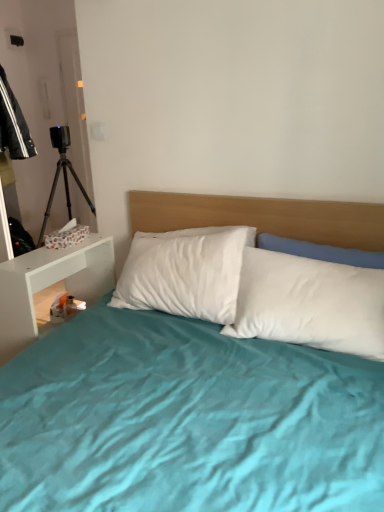
Where is `white plastic nightstand at left`? white plastic nightstand at left is located at coordinates (50, 285).

What is the approximate height of white plastic nightstand at left?

It is 31.94 inches.

Describe the element at coordinates (50, 285) in the screenshot. This screenshot has width=384, height=512. I see `white plastic nightstand at left` at that location.

You are a GUI agent. You are given a task and a screenshot of the screen. Output one action in this format:
    pyautogui.click(x=<x>, y=<y>)
    Task: Click on the white plastic nightstand at left
    
    Given the screenshot: What is the action you would take?
    pyautogui.click(x=50, y=285)